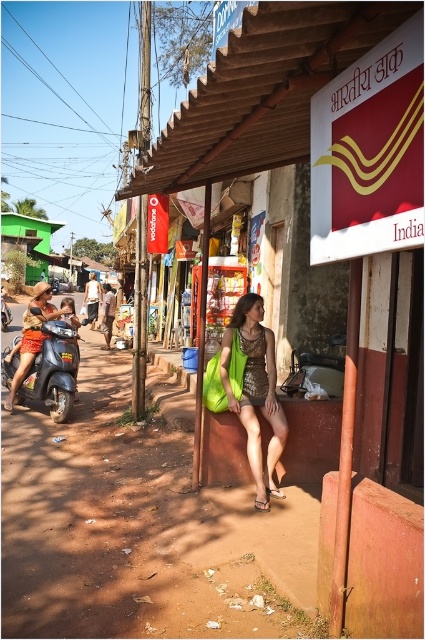
Is metallic blue scooter at left bigger than brown woven bag at center?

Incorrect, metallic blue scooter at left is not larger than brown woven bag at center.

Is metallic blue scooter at left further to camera compared to brown woven bag at center?

No, metallic blue scooter at left is closer to the viewer.

Is point (25, 392) closer to viewer compared to point (104, 317)?

Yes, point (25, 392) is in front of point (104, 317).

Where is `metallic blue scooter at left`? metallic blue scooter at left is located at coordinates (45, 369).

Is point (232, 328) behind point (105, 301)?

That is False.

From the picture: Can you confirm if matte green bag at center is positioned below brown woven bag at center?

Yes, matte green bag at center is below brown woven bag at center.

Between point (251, 468) and point (105, 300), which one is positioned behind?

The point (105, 300) is more distant.

The image size is (425, 640). I want to click on matte green bag at center, so click(x=255, y=392).

Does red fabric sign at upper center have a larger size compared to green fabric shoulder bag at center?

Indeed, red fabric sign at upper center has a larger size compared to green fabric shoulder bag at center.

Is point (380, 3) positioned behind point (238, 378)?

No, (380, 3) is in front of (238, 378).

Based on the photo, who is more distant from viewer, [201,147] or [240,355]?

The point [240,355] is more distant.

Identify the location of red fabric sign at upper center. point(336,259).